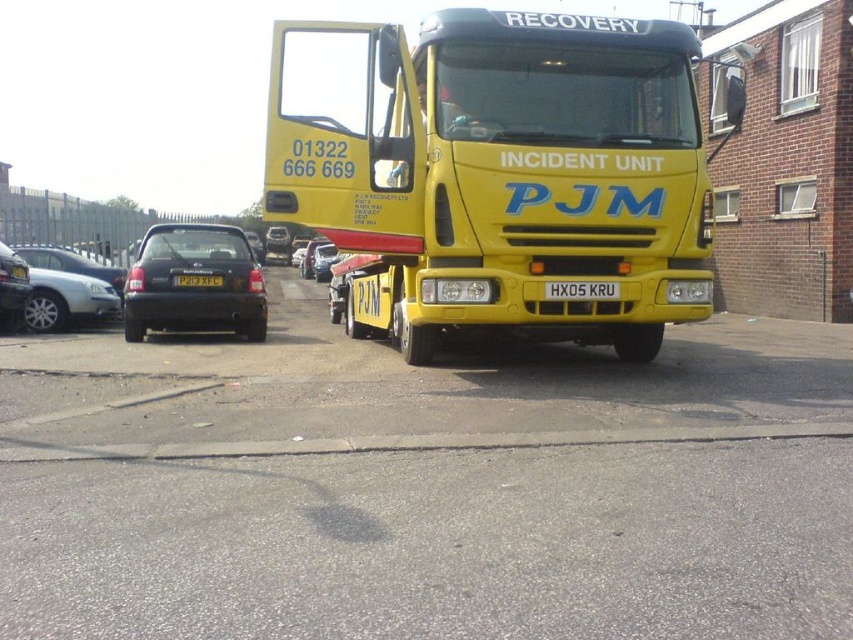
Describe the element at coordinates (67, 289) in the screenshot. This screenshot has width=853, height=640. I see `black metallic car at left` at that location.

Is black metallic car at left taller than white rectangular license plate at center?

Yes, black metallic car at left is taller than white rectangular license plate at center.

At what (x,y) coordinates should I click in order to perform the action: click on black metallic car at left. Please return your answer as a coordinate pair (x, y). Looking at the image, I should click on (67, 289).

Does black metallic car at left have a larger size compared to shiny black car at left?

Indeed, black metallic car at left has a larger size compared to shiny black car at left.

Which is behind, point (65, 291) or point (19, 301)?

Positioned behind is point (65, 291).

Identify the location of black metallic car at left. (67, 289).

Which of these two, yellow matte truck at center or black matte hatchback at left, stands shorter?

yellow matte truck at center

Can you confirm if yellow matte truck at center is taller than black matte hatchback at left?

No.

Which is in front, point (115, 452) or point (143, 314)?

Positioned in front is point (115, 452).

This screenshot has width=853, height=640. Identify the location of yellow matte truck at center. (425, 486).